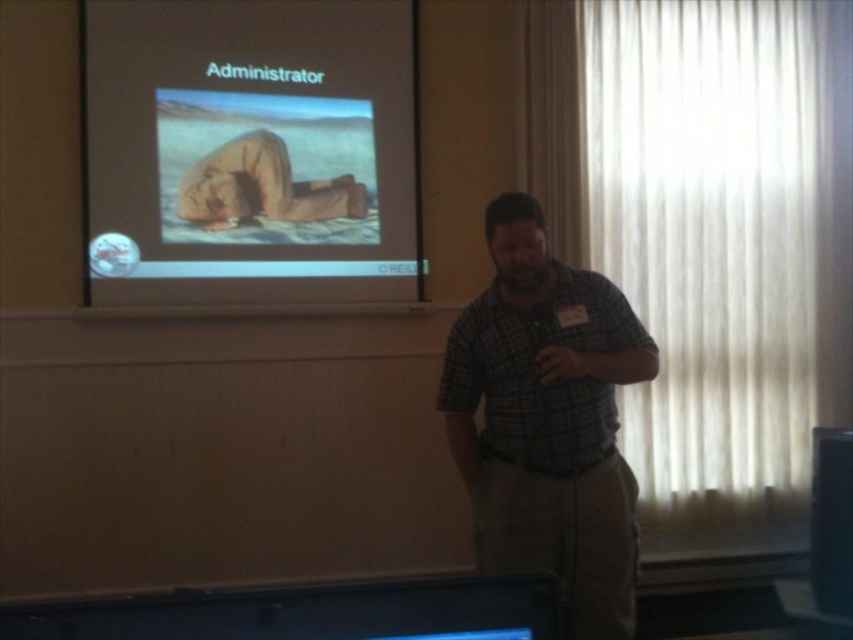
You are an attendee at the presentation and want to describe the presenter based on the image. Which object has a smaller width between the green plaid shirt at center and the tan fabric pants at center?

The green plaid shirt at center has a smaller width than the tan fabric pants at center.

You are an attendee at the presentation. You notice the matte projector screen at upper left and the green plaid shirt at center. Which object is positioned higher in the image?

The matte projector screen at upper left is located above the green plaid shirt at center, so it is positioned higher in the image.